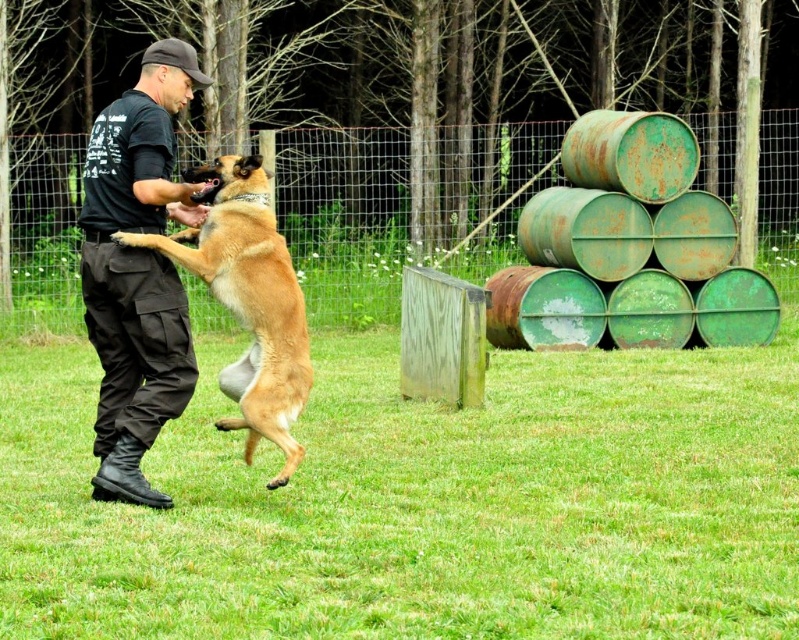
Based on the photo, can you confirm if rusty green barrel at right is bigger than furry golden dog at center?

Indeed, rusty green barrel at right has a larger size compared to furry golden dog at center.

Which is more to the left, rusty green barrel at right or furry golden dog at center?

Positioned to the left is furry golden dog at center.

Is point (690, 163) behind point (225, 241)?

Yes.

The height and width of the screenshot is (640, 799). Identify the location of rusty green barrel at right. pyautogui.click(x=637, y=236).

Where is `black cotton shirt at center`? The height and width of the screenshot is (640, 799). black cotton shirt at center is located at coordinates (137, 269).

Is black cotton shirt at center behind furry golden dog at center?

Yes, it is behind furry golden dog at center.

The image size is (799, 640). What are the coordinates of `black cotton shirt at center` in the screenshot? It's located at (137, 269).

Is rusty green barrel at right to the left of black cotton shirt at center from the viewer's perspective?

In fact, rusty green barrel at right is to the right of black cotton shirt at center.

Is rusty green barrel at right taller than black cotton shirt at center?

Yes.

The image size is (799, 640). What are the coordinates of `rusty green barrel at right` in the screenshot? It's located at (637, 236).